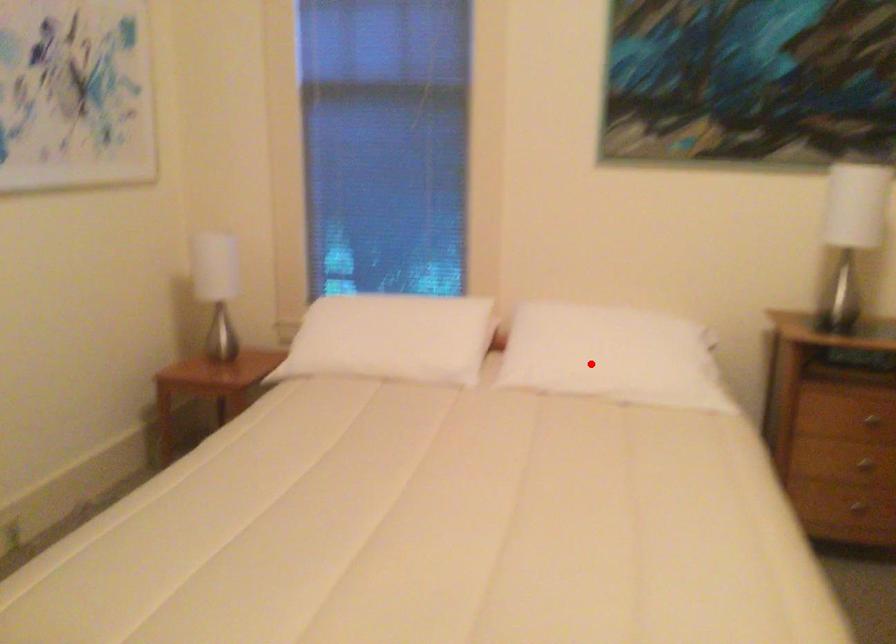
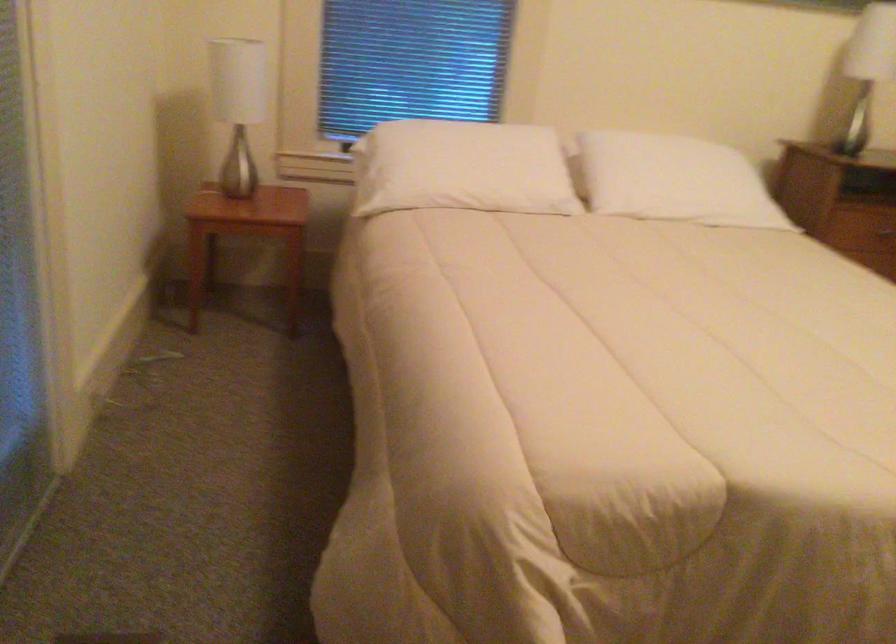
The point at the highlighted location is marked in the first image. Where is the corresponding point in the second image?

(673, 180)